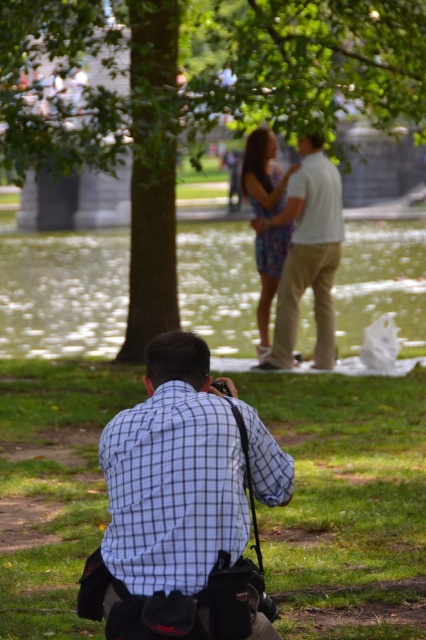
Does blue checkered shirt at lower center lie behind white cotton pants at center?

That is False.

The image size is (426, 640). What do you see at coordinates (172, 476) in the screenshot?
I see `blue checkered shirt at lower center` at bounding box center [172, 476].

Image resolution: width=426 pixels, height=640 pixels. Identify the location of blue checkered shirt at lower center. (172, 476).

Which is more to the left, green leafy tree at upper center or white cotton pants at center?

From the viewer's perspective, white cotton pants at center appears more on the left side.

Can you confirm if green leafy tree at upper center is taller than white cotton pants at center?

In fact, green leafy tree at upper center may be shorter than white cotton pants at center.

What do you see at coordinates (196, 97) in the screenshot?
I see `green leafy tree at upper center` at bounding box center [196, 97].

Where is `green leafy tree at upper center`? This screenshot has width=426, height=640. green leafy tree at upper center is located at coordinates (196, 97).

Who is more distant from viewer, (x=74, y=456) or (x=307, y=150)?

Positioned behind is point (x=307, y=150).

Is point (106, 378) farther from camera compared to point (294, 268)?

No, it is not.

Is point (339, 388) closer to camera compared to point (321, 339)?

Yes, point (339, 388) is closer to viewer.

Locate an element on the screen. The image size is (426, 640). green grass at lower center is located at coordinates (345, 502).